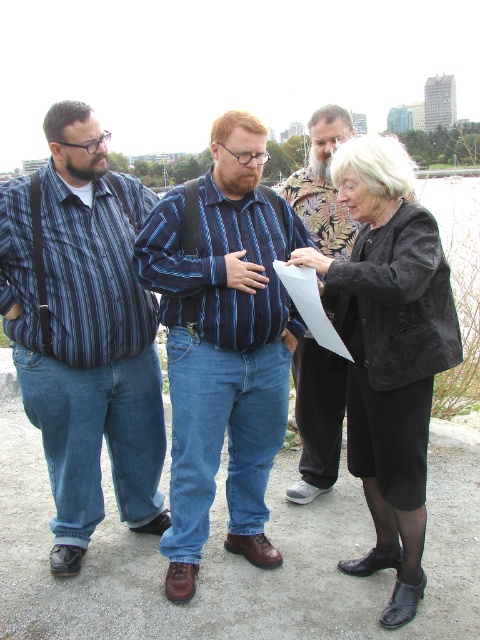
Question: Which point appears closest to the camera in this image?

Choices:
 (A) (312, 419)
 (B) (212, 433)
 (C) (301, 280)

Answer: (C)

Question: Estimate the real-world distances between objects in this image. Which object is farther from the striped cotton shirt at center?

Choices:
 (A) striped cotton shirt at left
 (B) blue striped shirt at center
 (C) black suede jacket at center

Answer: (A)

Question: Does striped cotton shirt at left appear on the left side of striped cotton shirt at center?

Choices:
 (A) no
 (B) yes

Answer: (B)

Question: Can you confirm if striped cotton shirt at left is bigger than white paper at center?

Choices:
 (A) yes
 (B) no

Answer: (A)

Question: Which object is positioned closest to the black suede jacket at center?

Choices:
 (A) blue striped shirt at center
 (B) striped cotton shirt at left
 (C) striped cotton shirt at center
 (D) white paper at center

Answer: (D)

Question: In this image, where is striped cotton shirt at left located relative to blue striped shirt at center?

Choices:
 (A) above
 (B) below

Answer: (A)